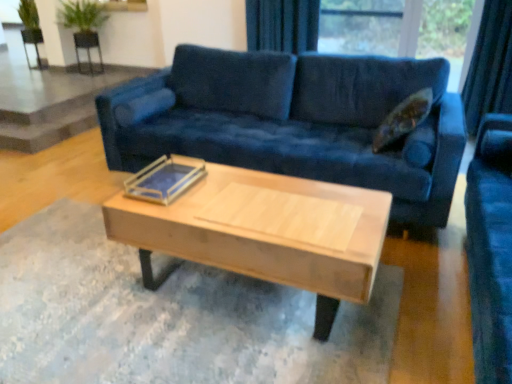
At what (x,y) coordinates should I click in order to perform the action: click on free region on the left part of black mesh chair at upper left, positioned as the first armchair in right-to-left order. Please return your answer as a coordinate pair (x, y). This screenshot has width=512, height=384. Looking at the image, I should click on (74, 73).